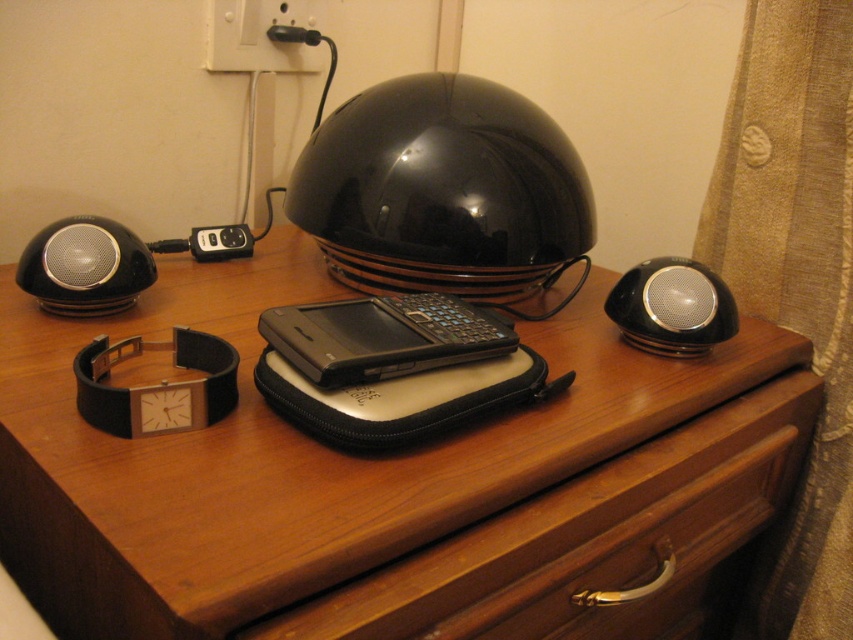
From the picture: You are standing in front of the wooden nightstand and want to place a small object between the two points labeled as point [491,188] and point [61,301]. Can you determine if the space between them is sufficient for placement?

Point [491,188] is behind point [61,301], so the space between them may not be sufficient for placing a small object as they are not aligned along the same plane.

You are organizing items on a wooden nightstand and need to place a new item between the wooden drawer at center and the glossy black helmet at center. Considering their sizes, which object should you place the new item closer to?

The wooden drawer at center is larger in size than the glossy black helmet at center, so the new item should be placed closer to the glossy black helmet at center to maintain balance.